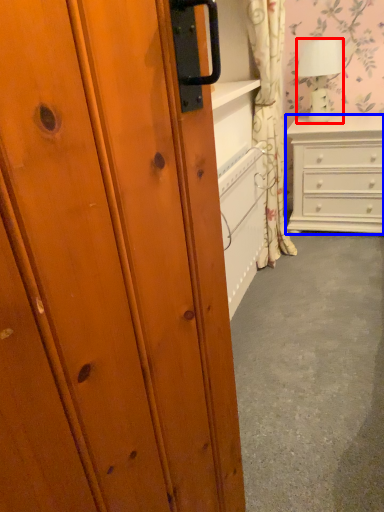
Question: Which point is closer to the camera, lamp (highlighted by a red box) or chest of drawers (highlighted by a blue box)?

Choices:
 (A) lamp
 (B) chest of drawers

Answer: (B)